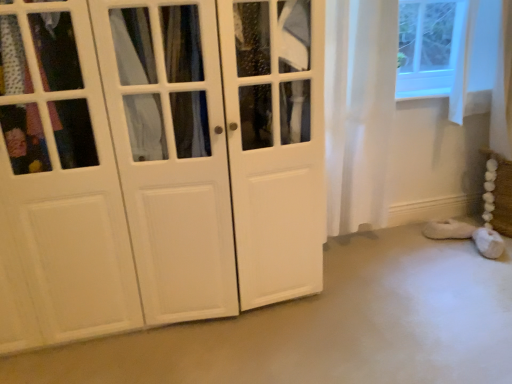
This screenshot has width=512, height=384. In order to click on vacant area situated below white sheer curtain at right (from a real-world perspective) in this screenshot , I will do `click(355, 251)`.